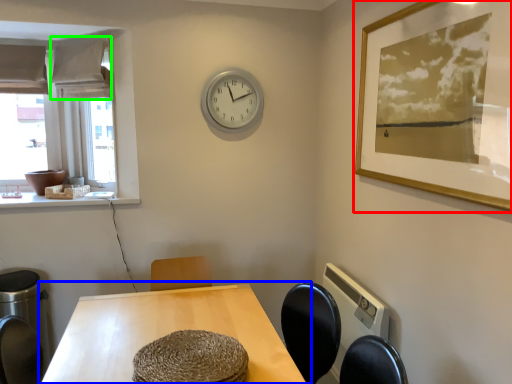
Question: Which is farther away from picture frame (highlighted by a red box)? table (highlighted by a blue box) or curtain (highlighted by a green box)?

Choices:
 (A) table
 (B) curtain

Answer: (B)